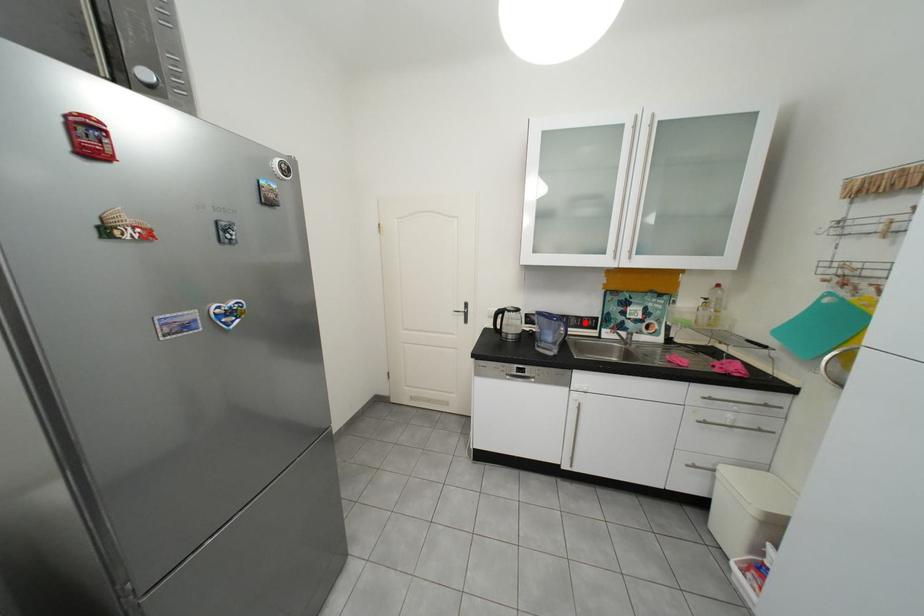
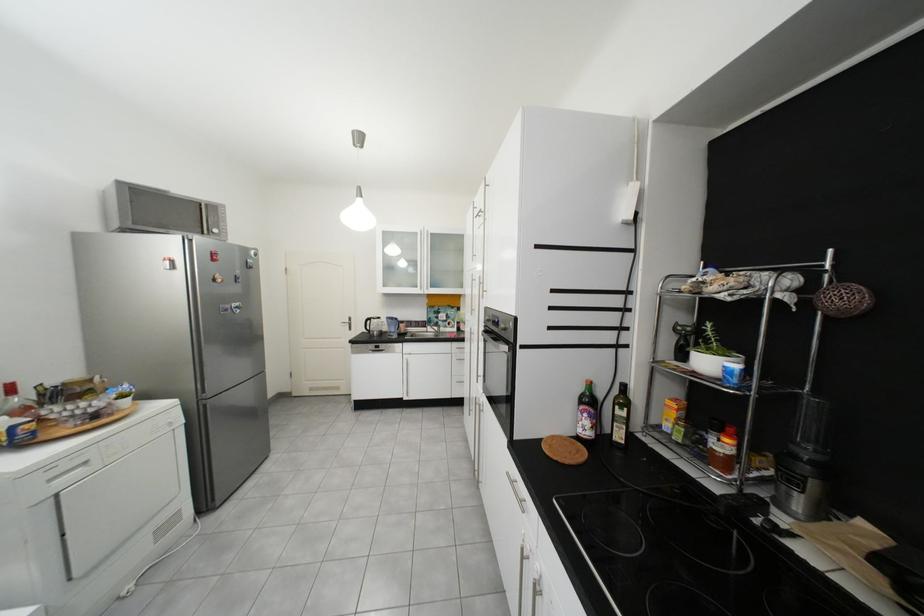
In the second image, find the point that corresponds to the highlighted location in the first image.

(426, 325)